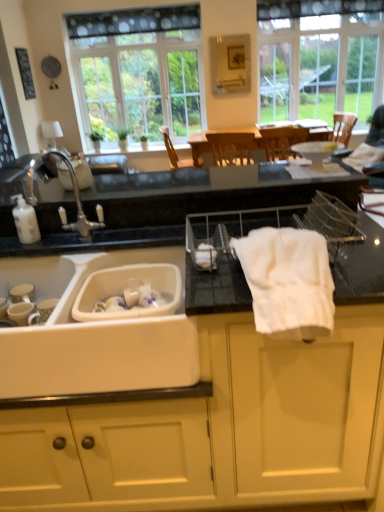
This screenshot has height=512, width=384. What do you see at coordinates (288, 282) in the screenshot?
I see `white cotton bath towel at center` at bounding box center [288, 282].

The height and width of the screenshot is (512, 384). I want to click on white cotton bath towel at center, so click(x=288, y=282).

Image resolution: width=384 pixels, height=512 pixels. I want to click on wooden chair at center, so click(x=173, y=151).

Where is `clear glass window at upper center, placed as the 1th window when sorted from left to right`? The image size is (384, 512). clear glass window at upper center, placed as the 1th window when sorted from left to right is located at coordinates (140, 70).

What is the approximate width of silver metallic faucet at left?

35.92 centimeters.

At what (x,y) coordinates should I click in order to perform the action: click on white matte cabinet at center. Please return your answer as a coordinate pair (x, y). This screenshot has width=384, height=512. Looking at the image, I should click on 217,428.

Where is `white plastic sink at lower left`? white plastic sink at lower left is located at coordinates (93, 334).

Can white plastic sink at lower left be found inside silver metallic faucet at left?

No.

Can you tell me how much silver metallic faucet at left and white plastic sink at lower left differ in facing direction?

silver metallic faucet at left and white plastic sink at lower left are facing 2.82 degrees away from each other.

Between point (32, 163) and point (43, 283), which one is positioned in front?

The point (43, 283) is closer to the camera.

Measure the distance from silver metallic faucet at left to white plastic sink at lower left.

silver metallic faucet at left and white plastic sink at lower left are 17.06 inches apart.

Do you think white matte cabinet at center is within white plastic soap dispenser at left, or outside of it?

white matte cabinet at center is not enclosed by white plastic soap dispenser at left.

Between white matte cabinet at center and white plastic soap dispenser at left, which one has smaller size?

Smaller between the two is white plastic soap dispenser at left.

From a real-world perspective, which is physically below, white matte cabinet at center or white plastic soap dispenser at left?

From a 3D spatial view, white matte cabinet at center is below.

Which is more to the left, white matte cabinet at center or white plastic soap dispenser at left?

From the viewer's perspective, white plastic soap dispenser at left appears more on the left side.

In the scene shown: Is wooden chair at center to the left of white plastic soap dispenser at left from the viewer's perspective?

In fact, wooden chair at center is to the right of white plastic soap dispenser at left.

Is wooden chair at center in contact with white plastic soap dispenser at left?

wooden chair at center and white plastic soap dispenser at left are clearly separated.

Based on their sizes in the image, would you say wooden chair at center is bigger or smaller than white plastic soap dispenser at left?

In the image, wooden chair at center appears to be larger than white plastic soap dispenser at left.

Between point (164, 127) and point (25, 205), which one is positioned in front?

The point (25, 205) is in front.

Relative to white cotton bath towel at center, is clear glass window at upper right, acting as the 1th window starting from the right, in front or behind?

clear glass window at upper right, acting as the 1th window starting from the right, is behind white cotton bath towel at center.

Is clear glass window at upper right, the 2th window viewed from the left, wider or thinner than white cotton bath towel at center?

In the image, clear glass window at upper right, the 2th window viewed from the left, appears to be more narrow than white cotton bath towel at center.

Visually, is clear glass window at upper right, acting as the 1th window starting from the right, positioned to the left or to the right of white cotton bath towel at center?

Clearly, clear glass window at upper right, acting as the 1th window starting from the right, is on the right of white cotton bath towel at center in the image.

Considering the positions of points (325, 37) and (235, 251), is point (325, 37) closer to camera compared to point (235, 251)?

That is False.

Locate an element on the screen. This screenshot has width=384, height=512. cabinetry lying on the right of silver metallic faucet at left is located at coordinates (217, 428).

Is silver metallic faucet at left located outside white matte cabinet at center?

No, silver metallic faucet at left is inside or overlapping with white matte cabinet at center.

Between point (31, 201) and point (234, 370), which one is positioned behind?

The point (31, 201) is behind.

Can you confirm if silver metallic faucet at left is smaller than white matte cabinet at center?

Correct, silver metallic faucet at left occupies less space than white matte cabinet at center.

Could you tell me if silver metallic faucet at left is facing clear glass window at upper right, the 2th window viewed from the left?

No, silver metallic faucet at left is not oriented towards clear glass window at upper right, the 2th window viewed from the left.

Which is correct: silver metallic faucet at left is inside clear glass window at upper right, acting as the 1th window starting from the right, or outside of it?

silver metallic faucet at left is spatially situated outside clear glass window at upper right, acting as the 1th window starting from the right.

From a real-world perspective, who is located higher, silver metallic faucet at left or clear glass window at upper right, the 2th window viewed from the left?

clear glass window at upper right, the 2th window viewed from the left, is physically above.

Identify the location of window on the right of silver metallic faucet at left. (319, 58).

Can you confirm if white cotton bath towel at center is smaller than white matte cabinet at center?

Yes, white cotton bath towel at center is smaller than white matte cabinet at center.

Considering the positions of objects white cotton bath towel at center and white matte cabinet at center in the image provided, who is more to the left, white cotton bath towel at center or white matte cabinet at center?

white matte cabinet at center.

From a real-world perspective, is white cotton bath towel at center on top of white matte cabinet at center?

Correct, in the physical world, white cotton bath towel at center is higher than white matte cabinet at center.

Does white cotton bath towel at center lie in front of white matte cabinet at center?

Yes, white cotton bath towel at center is closer to the viewer.

This screenshot has height=512, width=384. In the image, there is a silver metallic faucet at left. Find the location of `sink below it (from the image's perspective)`. sink below it (from the image's perspective) is located at coordinates (93, 334).

The image size is (384, 512). I want to click on toiletry that is above the white matte cabinet at center (from a real-world perspective), so click(x=25, y=220).

Estimate the real-world distances between objects in this image. Which object is further from white plastic soap dispenser at left, white plastic sink at lower left or clear glass window at upper center, placed as the 1th window when sorted from left to right?

Based on the image, clear glass window at upper center, placed as the 1th window when sorted from left to right, appears to be further to white plastic soap dispenser at left.

Considering their positions, is white plastic soap dispenser at left positioned further to white plastic sink at lower left than wooden chair at center?

wooden chair at center is further to white plastic sink at lower left.

Considering their positions, is white plastic soap dispenser at left positioned further to white plastic sink at lower left than clear glass window at upper right, acting as the 1th window starting from the right?

clear glass window at upper right, acting as the 1th window starting from the right, is further to white plastic sink at lower left.

Based on the photo, which object lies nearer to the anchor point wooden chair at center, silver metallic faucet at left or white plastic sink at lower left?

silver metallic faucet at left is positioned closer to the anchor wooden chair at center.

Based on their spatial positions, is silver metallic faucet at left or wooden chair at center closer to white cotton bath towel at center?

Among the two, silver metallic faucet at left is located nearer to white cotton bath towel at center.

Which object lies further to the anchor point white plastic soap dispenser at left, white matte cabinet at center or white cotton bath towel at center?

white cotton bath towel at center is positioned further to the anchor white plastic soap dispenser at left.

Based on their spatial positions, is silver metallic faucet at left or clear glass window at upper right, the 2th window viewed from the left, further from white matte cabinet at center?

clear glass window at upper right, the 2th window viewed from the left, lies further to white matte cabinet at center than the other object.

When comparing their distances from white cotton bath towel at center, does white plastic sink at lower left or clear glass window at upper right, acting as the 1th window starting from the right, seem closer?

Among the two, white plastic sink at lower left is located nearer to white cotton bath towel at center.

Where is `window between white plastic soap dispenser at left and clear glass window at upper center, marked as the second window in a right-to-left arrangement, from front to back`? window between white plastic soap dispenser at left and clear glass window at upper center, marked as the second window in a right-to-left arrangement, from front to back is located at coordinates (319, 58).

The width and height of the screenshot is (384, 512). Identify the location of chair between white plastic sink at lower left and clear glass window at upper center, marked as the second window in a right-to-left arrangement, in the front-back direction. (173, 151).

What are the coordinates of `sink between silver metallic faucet at left and white cotton bath towel at center` in the screenshot? It's located at (93, 334).

The width and height of the screenshot is (384, 512). Find the location of `window between silver metallic faucet at left and clear glass window at upper center, marked as the second window in a right-to-left arrangement, in the front-back direction`. window between silver metallic faucet at left and clear glass window at upper center, marked as the second window in a right-to-left arrangement, in the front-back direction is located at coordinates (319, 58).